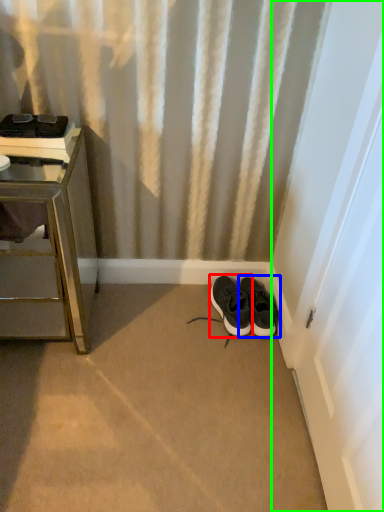
Question: Which is farther away from footwear (highlighted by a red box)? footwear (highlighted by a blue box) or screen door (highlighted by a green box)?

Choices:
 (A) footwear
 (B) screen door

Answer: (B)